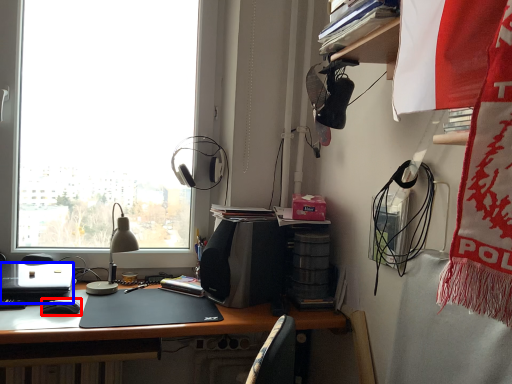
Question: Which object appears closest to the camera in this image, mouse (highlighted by a red box) or laptop (highlighted by a blue box)?

Choices:
 (A) mouse
 (B) laptop

Answer: (B)